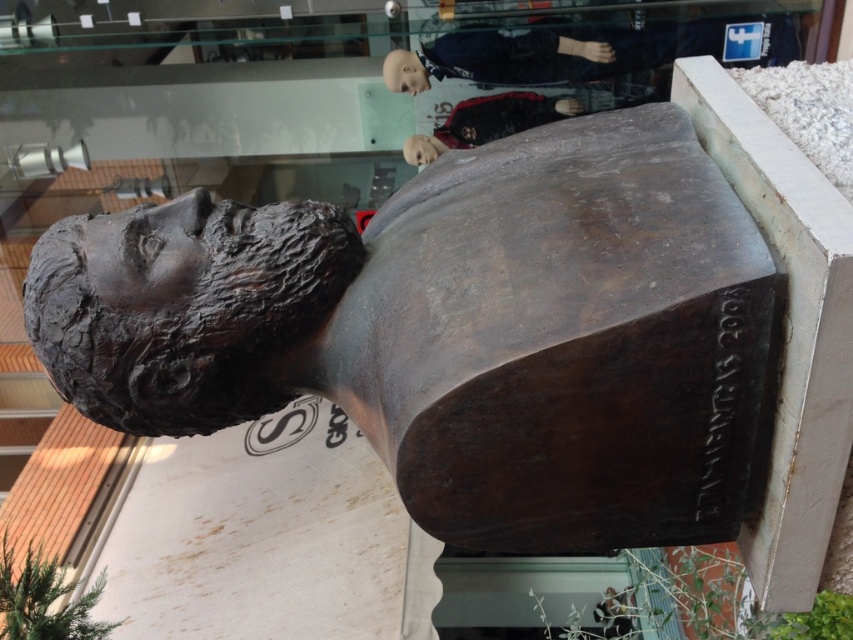
You are standing in front of a store with a bronze sculpture at center. If you look at the sculpture from the storefront entrance, which direction would the sculpture be relative to you?

The bronze sculpture at center is located at coordinates point (184, 307), so it would be directly in front of you when facing the storefront entrance.